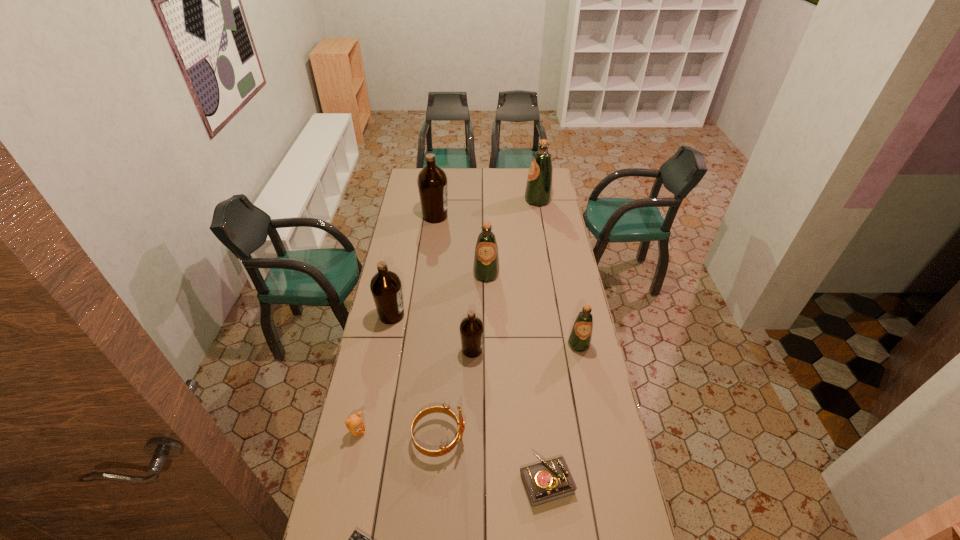
Image resolution: width=960 pixels, height=540 pixels. I want to click on vacant space at the right edge, so click(x=557, y=193).

Where is `vacant space in between the farthest green olive oil and the tiara`? vacant space in between the farthest green olive oil and the tiara is located at coordinates (489, 319).

You are a GUI agent. You are given a task and a screenshot of the screen. Output one action in this format:
    pyautogui.click(x=<x>, y=<y>)
    Task: Click on the free spot between the nearest brown olive oil and the farthest olive oil
    
    Given the screenshot: What is the action you would take?
    pyautogui.click(x=505, y=275)

The image size is (960, 540). Find the location of `free spot between the diary and the third nearest olive oil`. free spot between the diary and the third nearest olive oil is located at coordinates (469, 399).

Identify the location of free space between the farthest object and the third nearest olive oil. (465, 258).

In order to click on vacant space in between the farthest green olive oil and the third shortest object in this screenshot , I will do `click(447, 316)`.

Where is `empty space between the fourth farthest object and the smallest green olive oil`? empty space between the fourth farthest object and the smallest green olive oil is located at coordinates (485, 330).

This screenshot has height=540, width=960. I want to click on free area in between the rightmost brown olive oil and the farthest olive oil, so click(x=505, y=275).

Image resolution: width=960 pixels, height=540 pixels. In order to click on blank region between the red tiara and the brown teddy bear in this screenshot , I will do `click(398, 435)`.

What are the coordinates of `free area in between the nearest green olive oil and the second nearest green olive oil` in the screenshot? It's located at (533, 309).